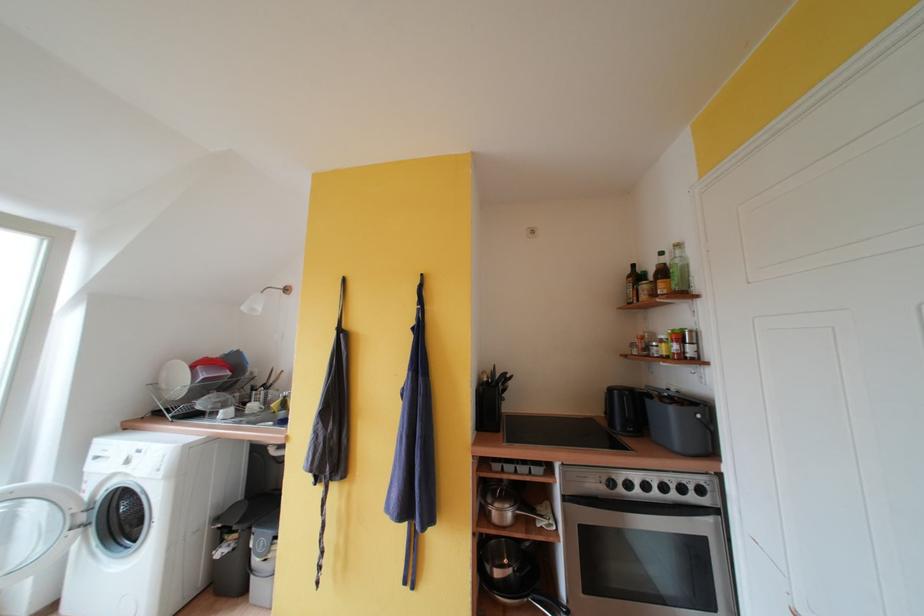
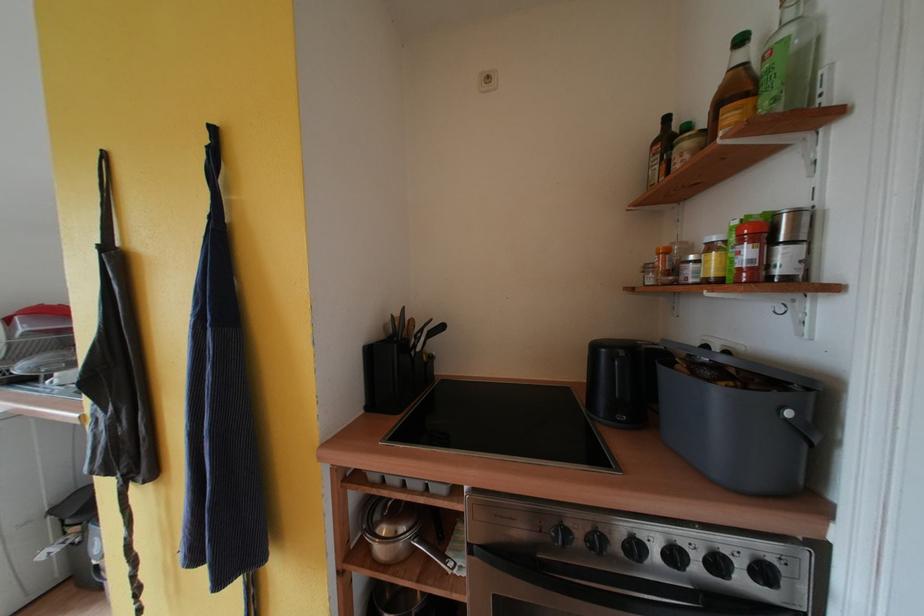
The point at [666,257] is marked in the first image. Where is the corresponding point in the second image?

(748, 44)